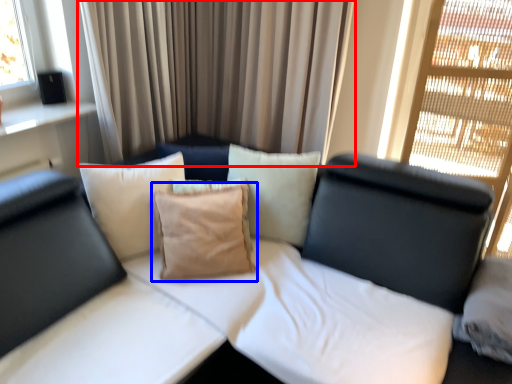
Question: Which point is closer to the camera, curtain (highlighted by a red box) or pillow (highlighted by a blue box)?

Choices:
 (A) curtain
 (B) pillow

Answer: (B)